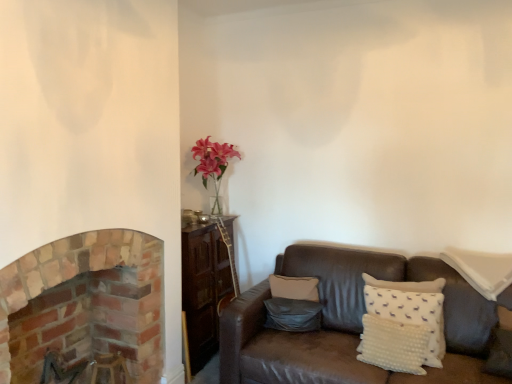
Image resolution: width=512 pixels, height=384 pixels. Describe the element at coordinates (293, 314) in the screenshot. I see `matte gray pillow at center, which is the 3th pillow from right to left` at that location.

What is the approximate width of matte gray pillow at center, which is the 3th pillow from right to left?

The width of matte gray pillow at center, which is the 3th pillow from right to left, is 6.21 inches.

Describe the element at coordinates (482, 270) in the screenshot. I see `white dotted pillow at right, which is the first pillow in right-to-left order` at that location.

This screenshot has height=384, width=512. Describe the element at coordinates (84, 304) in the screenshot. I see `brick fireplace at left` at that location.

Identify the location of matte gray pillow at center, which ranks as the first pillow in left-to-right order. The image size is (512, 384). (293, 314).

From the image's perspective, which is below, matte gray pillow at center, which ranks as the first pillow in left-to-right order, or white dotted pillow at lower right, which is the second pillow in left-to-right order?

white dotted pillow at lower right, which is the second pillow in left-to-right order.

Is matte gray pillow at center, which is the 3th pillow from right to left, oriented away from white dotted pillow at lower right, which is the second pillow in right-to-left order?

No, white dotted pillow at lower right, which is the second pillow in right-to-left order, is not at the back of matte gray pillow at center, which is the 3th pillow from right to left.

Does point (308, 314) lie behind point (369, 349)?

Yes.

Are brick fireplace at left and matte gray pillow at center, which ranks as the first pillow in left-to-right order, far apart?

Yes, brick fireplace at left and matte gray pillow at center, which ranks as the first pillow in left-to-right order, are quite far apart.

Can you confirm if brick fireplace at left is shorter than matte gray pillow at center, which ranks as the first pillow in left-to-right order?

No.

Is brick fireplace at left positioned beyond the bounds of matte gray pillow at center, which is the 3th pillow from right to left?

brick fireplace at left lies outside matte gray pillow at center, which is the 3th pillow from right to left,'s area.

Can you tell me how much matte gray pillow at center, which ranks as the first pillow in left-to-right order, and white dotted pillow at right, the third pillow positioned from the left, differ in facing direction?

They differ by 14.9 degrees in their facing directions.

Considering their positions, is matte gray pillow at center, which is the 3th pillow from right to left, located in front of or behind white dotted pillow at right, which is the first pillow in right-to-left order?

Visually, matte gray pillow at center, which is the 3th pillow from right to left, is located behind white dotted pillow at right, which is the first pillow in right-to-left order.

Can you confirm if matte gray pillow at center, which ranks as the first pillow in left-to-right order, is positioned to the left of white dotted pillow at right, which is the first pillow in right-to-left order?

Yes, matte gray pillow at center, which ranks as the first pillow in left-to-right order, is to the left of white dotted pillow at right, which is the first pillow in right-to-left order.

From the image's perspective, is white dotted pillow at lower right, which is the second pillow in left-to-right order, located beneath white dotted pillow at right, the third pillow positioned from the left?

Yes.

In terms of size, does white dotted pillow at lower right, which is the second pillow in right-to-left order, appear bigger or smaller than white dotted pillow at right, which is the first pillow in right-to-left order?

Clearly, white dotted pillow at lower right, which is the second pillow in right-to-left order, is smaller in size than white dotted pillow at right, which is the first pillow in right-to-left order.

Does white dotted pillow at lower right, which is the second pillow in right-to-left order, appear on the right side of white dotted pillow at right, the third pillow positioned from the left?

In fact, white dotted pillow at lower right, which is the second pillow in right-to-left order, is to the left of white dotted pillow at right, the third pillow positioned from the left.

The image size is (512, 384). Identify the location of pillow on the right of white dotted pillow at lower right, which is the second pillow in left-to-right order. (482, 270).

How far apart are brick fireplace at left and white dotted pillow at lower right, which is the second pillow in left-to-right order?

A distance of 4.59 feet exists between brick fireplace at left and white dotted pillow at lower right, which is the second pillow in left-to-right order.

Considering the sizes of brick fireplace at left and white dotted pillow at lower right, which is the second pillow in right-to-left order, in the image, is brick fireplace at left bigger or smaller than white dotted pillow at lower right, which is the second pillow in right-to-left order,?

brick fireplace at left is bigger than white dotted pillow at lower right, which is the second pillow in right-to-left order.

Is brick fireplace at left located outside white dotted pillow at lower right, which is the second pillow in left-to-right order?

Yes, brick fireplace at left is located beyond the bounds of white dotted pillow at lower right, which is the second pillow in left-to-right order.

Is white dotted pillow at lower right, which is the second pillow in left-to-right order, at the back of brick fireplace at left?

brick fireplace at left is not turned away from white dotted pillow at lower right, which is the second pillow in left-to-right order.

Considering the sizes of white dotted pillow at right, the third pillow positioned from the left, and matte gray pillow at center, which is the 3th pillow from right to left, in the image, is white dotted pillow at right, the third pillow positioned from the left, wider or thinner than matte gray pillow at center, which is the 3th pillow from right to left,?

In the image, white dotted pillow at right, the third pillow positioned from the left, appears to be wider than matte gray pillow at center, which is the 3th pillow from right to left.

Locate an element on the screen. This screenshot has width=512, height=384. pillow above the matte gray pillow at center, which ranks as the first pillow in left-to-right order (from the image's perspective) is located at coordinates (482, 270).

Considering the positions of point (504, 270) and point (311, 313), is point (504, 270) closer or farther from the camera than point (311, 313)?

Clearly, point (504, 270) is closer to the camera than point (311, 313).

Between white dotted pillow at right, the third pillow positioned from the left, and matte gray pillow at center, which ranks as the first pillow in left-to-right order, which one appears on the left side from the viewer's perspective?

From the viewer's perspective, matte gray pillow at center, which ranks as the first pillow in left-to-right order, appears more on the left side.

Is white dotted pillow at right, which is the first pillow in right-to-left order, positioned beyond the bounds of white dotted pillow at lower right, which is the second pillow in left-to-right order?

Indeed, white dotted pillow at right, which is the first pillow in right-to-left order, is completely outside white dotted pillow at lower right, which is the second pillow in left-to-right order.

Can you tell me how much white dotted pillow at right, the third pillow positioned from the left, and white dotted pillow at lower right, which is the second pillow in right-to-left order, differ in facing direction?

They differ by 10.4 degrees in their facing directions.

Is white dotted pillow at right, which is the first pillow in right-to-left order, oriented away from white dotted pillow at lower right, which is the second pillow in left-to-right order?

No, white dotted pillow at right, which is the first pillow in right-to-left order, is not facing away from white dotted pillow at lower right, which is the second pillow in left-to-right order.

Is white dotted pillow at right, which is the first pillow in right-to-left order, positioned in front of white dotted pillow at lower right, which is the second pillow in right-to-left order?

That is False.

Where is `pillow located underneath the white dotted pillow at lower right, which is the second pillow in right-to-left order (from a real-world perspective)`? This screenshot has height=384, width=512. pillow located underneath the white dotted pillow at lower right, which is the second pillow in right-to-left order (from a real-world perspective) is located at coordinates (293, 314).

The width and height of the screenshot is (512, 384). I want to click on fireplace above the matte gray pillow at center, which ranks as the first pillow in left-to-right order (from the image's perspective), so click(84, 304).

Estimate the real-world distances between objects in this image. Which object is closer to brick fireplace at left, white dotted pillow at lower right, which is the second pillow in right-to-left order, or matte gray pillow at center, which is the 3th pillow from right to left?

The object closer to brick fireplace at left is matte gray pillow at center, which is the 3th pillow from right to left.

Which object lies further to the anchor point white dotted pillow at lower right, which is the second pillow in right-to-left order, brick fireplace at left or matte gray pillow at center, which ranks as the first pillow in left-to-right order?

brick fireplace at left.

Based on the photo, when comparing their distances from white dotted pillow at lower right, which is the second pillow in right-to-left order, does white dotted pillow at right, which is the first pillow in right-to-left order, or matte gray pillow at center, which ranks as the first pillow in left-to-right order, seem further?

white dotted pillow at right, which is the first pillow in right-to-left order, is positioned further to the anchor white dotted pillow at lower right, which is the second pillow in right-to-left order.

Estimate the real-world distances between objects in this image. Which object is further from brick fireplace at left, white dotted pillow at right, the third pillow positioned from the left, or matte gray pillow at center, which is the 3th pillow from right to left?

white dotted pillow at right, the third pillow positioned from the left, is further to brick fireplace at left.

When comparing their distances from brick fireplace at left, does white dotted pillow at lower right, which is the second pillow in left-to-right order, or white dotted pillow at right, which is the first pillow in right-to-left order, seem closer?

white dotted pillow at lower right, which is the second pillow in left-to-right order.

In the scene shown: From the image, which object appears to be nearer to white dotted pillow at right, which is the first pillow in right-to-left order, white dotted pillow at lower right, which is the second pillow in left-to-right order, or matte gray pillow at center, which ranks as the first pillow in left-to-right order?

Among the two, white dotted pillow at lower right, which is the second pillow in left-to-right order, is located nearer to white dotted pillow at right, which is the first pillow in right-to-left order.

Based on their spatial positions, is brick fireplace at left or matte gray pillow at center, which is the 3th pillow from right to left, further from white dotted pillow at right, the third pillow positioned from the left?

Among the two, brick fireplace at left is located further to white dotted pillow at right, the third pillow positioned from the left.

Looking at the image, which one is located closer to white dotted pillow at lower right, which is the second pillow in left-to-right order, matte gray pillow at center, which is the 3th pillow from right to left, or white dotted pillow at right, which is the first pillow in right-to-left order?

Based on the image, matte gray pillow at center, which is the 3th pillow from right to left, appears to be nearer to white dotted pillow at lower right, which is the second pillow in left-to-right order.

Locate an element on the screen. This screenshot has width=512, height=384. pillow located between brick fireplace at left and white dotted pillow at lower right, which is the second pillow in left-to-right order, in the left-right direction is located at coordinates (293, 314).

Image resolution: width=512 pixels, height=384 pixels. In order to click on pillow between matte gray pillow at center, which ranks as the first pillow in left-to-right order, and white dotted pillow at right, the third pillow positioned from the left in this screenshot , I will do `click(393, 345)`.